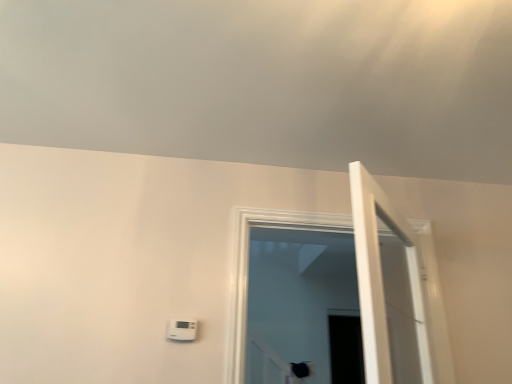
Question: Is transparent glass door at center situated inside white plastic thermostat at lower center or outside?

Choices:
 (A) outside
 (B) inside

Answer: (A)

Question: From the image's perspective, is transparent glass door at center above or below white plastic thermostat at lower center?

Choices:
 (A) above
 (B) below

Answer: (A)

Question: Based on their relative distances, which object is nearer to the white plastic thermostat at lower center?

Choices:
 (A) transparent glass door at center
 (B) white wooden door at right

Answer: (A)

Question: Which object is the farthest from the white wooden door at right?

Choices:
 (A) white plastic thermostat at lower center
 (B) transparent glass door at center

Answer: (A)